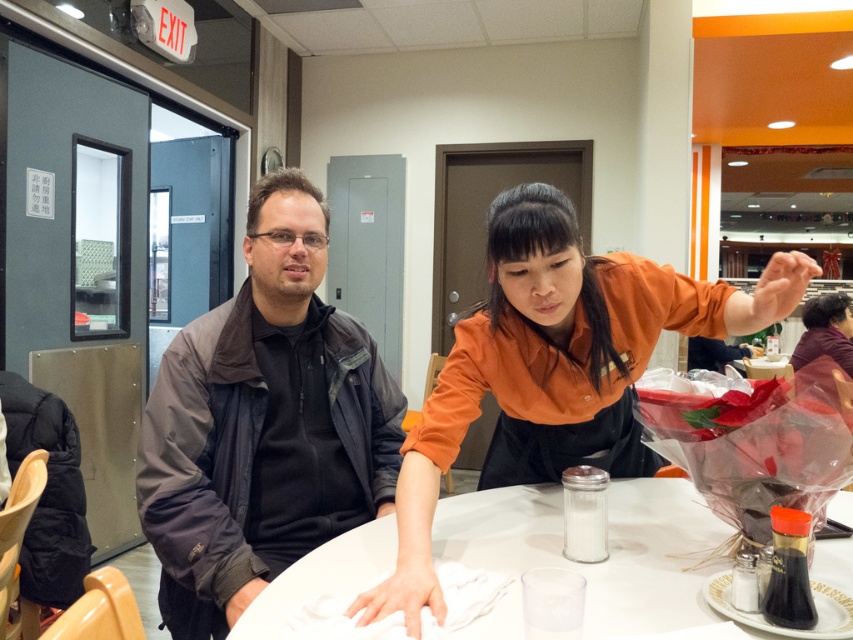
Question: Can you confirm if dark gray jacket at center is wider than white glossy table at center?

Choices:
 (A) yes
 (B) no

Answer: (B)

Question: Which point is farther to the camera?

Choices:
 (A) white glossy table at center
 (B) dark gray jacket at center
 (C) orange shirt at center

Answer: (B)

Question: Considering the real-world distances, which object is closest to the orange shirt at center?

Choices:
 (A) white glossy table at center
 (B) dark gray jacket at center

Answer: (A)

Question: Which object is positioned farthest from the orange shirt at center?

Choices:
 (A) dark gray jacket at center
 (B) white glossy table at center

Answer: (A)

Question: Can you confirm if dark gray jacket at center is thinner than white glossy table at center?

Choices:
 (A) no
 (B) yes

Answer: (B)

Question: Does orange shirt at center have a smaller size compared to white glossy table at center?

Choices:
 (A) no
 (B) yes

Answer: (A)